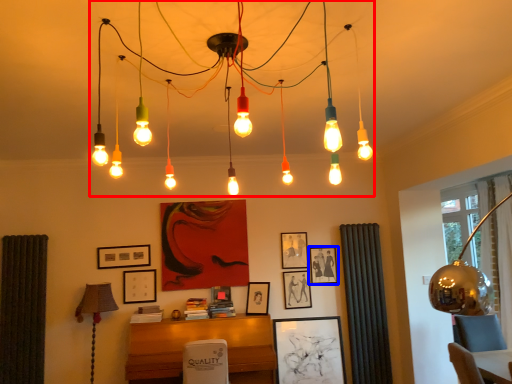
Question: Which object is closer to the camera taking this photo, chandelier (highlighted by a red box) or picture frame (highlighted by a blue box)?

Choices:
 (A) chandelier
 (B) picture frame

Answer: (A)